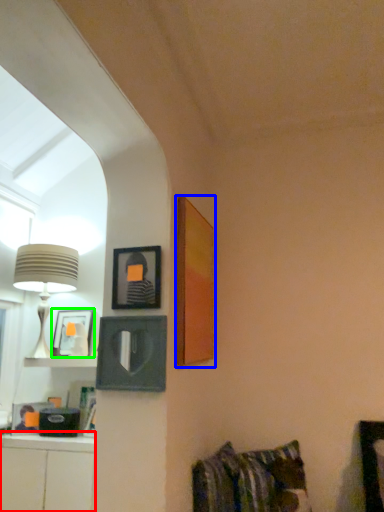
Question: Which is nearer to the cabinetry (highlighted by a red box)? picture frame (highlighted by a blue box) or picture frame (highlighted by a green box).

Choices:
 (A) picture frame
 (B) picture frame

Answer: (B)